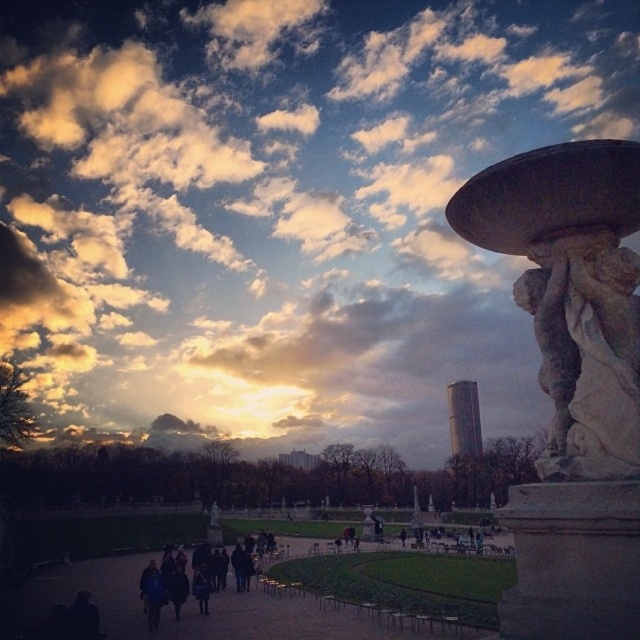
Question: Does cloudy sky at upper center come behind dark fabric path at lower left?

Choices:
 (A) no
 (B) yes

Answer: (A)

Question: In this image, where is cloudy sky at upper center located relative to white marble statue at center?

Choices:
 (A) above
 (B) below

Answer: (A)

Question: Which point is closer to the camera?

Choices:
 (A) white marble statue at center
 (B) dark blue jacket at center
 (C) white marble statue at right

Answer: (A)

Question: Does white marble statue at center come behind dark blue jacket at center?

Choices:
 (A) yes
 (B) no

Answer: (B)

Question: Which point is closer to the camera taking this photo?

Choices:
 (A) (490, 136)
 (B) (621, 378)
 (C) (186, 596)
 (D) (326, 609)

Answer: (B)

Question: Which object is farther from the camera taking this photo?

Choices:
 (A) dark fabric path at lower left
 (B) dark blue jacket at center

Answer: (B)